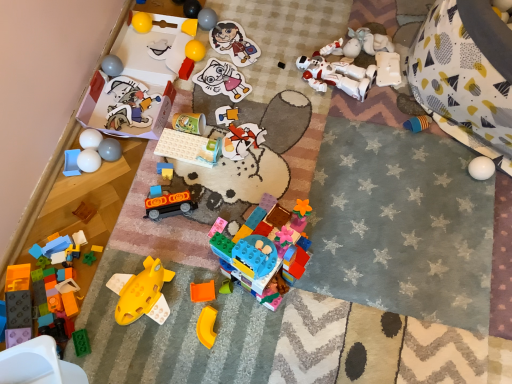
The width and height of the screenshot is (512, 384). I want to click on free space in front of orange matte toy airplane at center, the 16th toy positioned from the left, so click(203, 346).